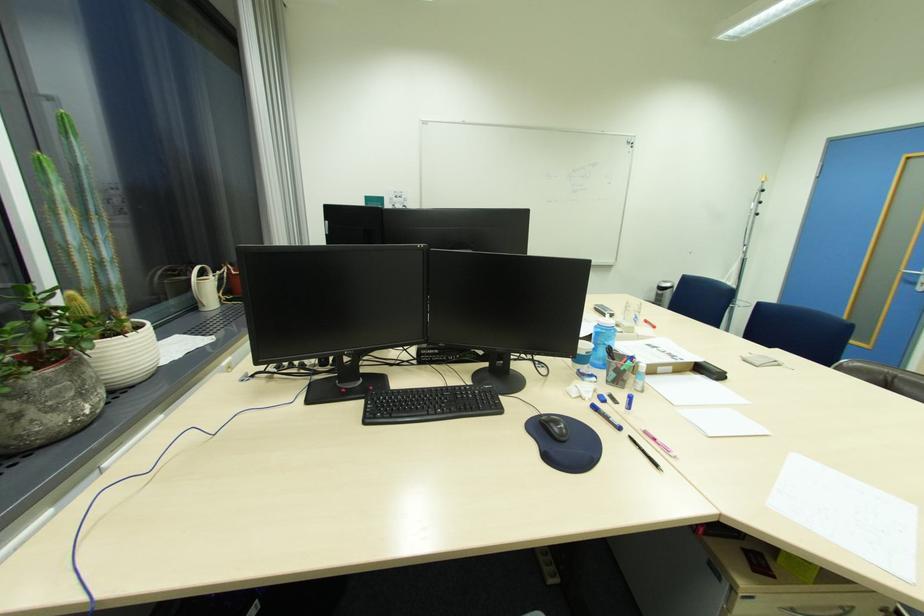
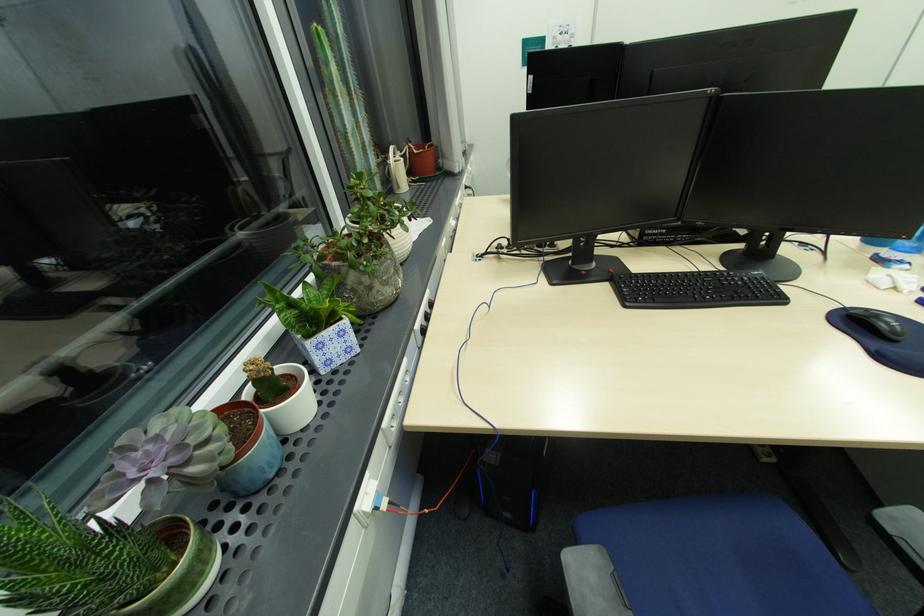
Question: In a continuous first-person perspective shot, in which direction is the camera moving?

Choices:
 (A) Left
 (B) Right
 (C) Forward
 (D) Backward

Answer: (A)